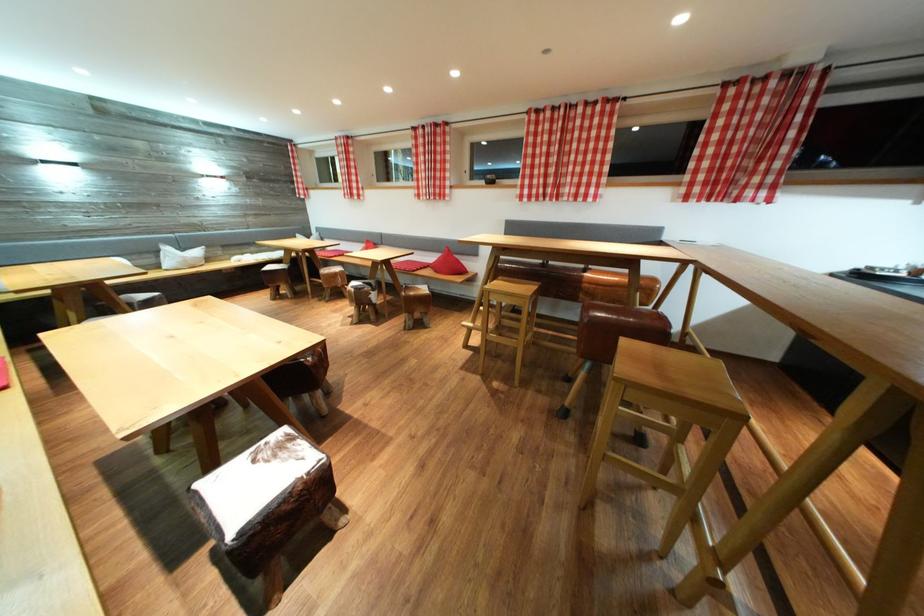
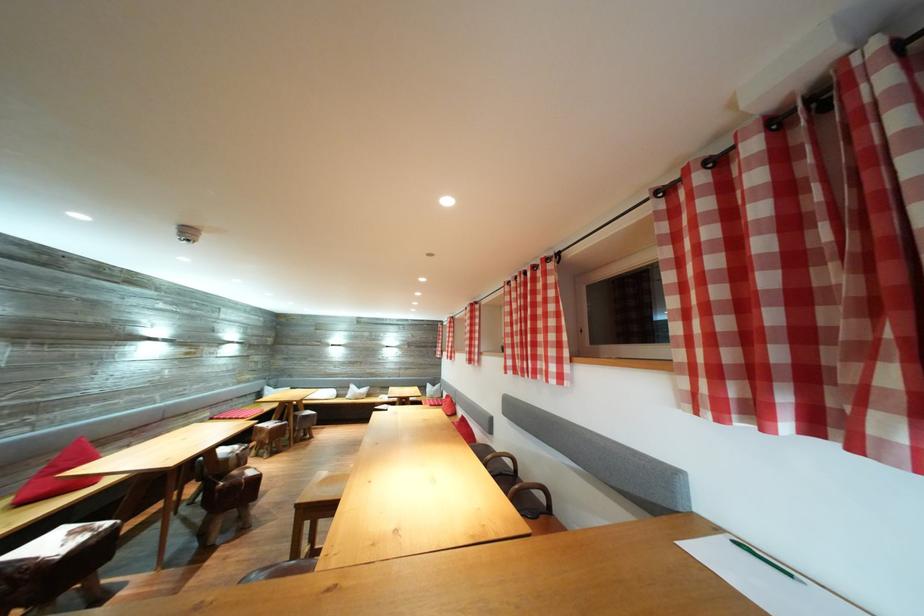
Locate, in the second image, the point that corresponds to the point at 176,254 in the first image.

(359, 392)